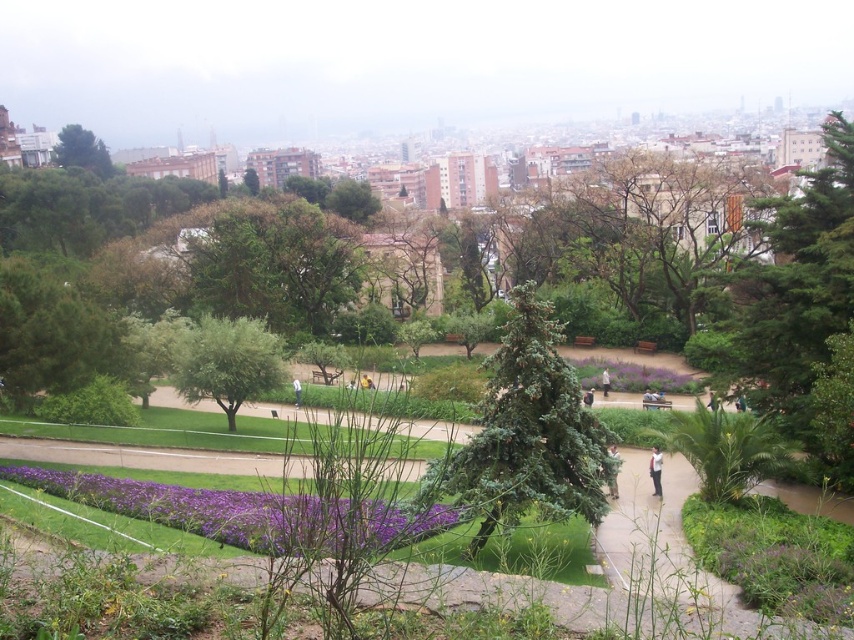
Between purple matte flower at center and brown leather backpack at center-right, which one appears on the right side from the viewer's perspective?

From the viewer's perspective, purple matte flower at center appears more on the right side.

Who is lower down, purple matte flower at center or brown leather backpack at center-right?

brown leather backpack at center-right

Locate an element on the screen. purple matte flower at center is located at coordinates (630, 376).

Find the location of a particular element. The image size is (854, 640). purple matte flower at center is located at coordinates (630, 376).

Which is below, purple matte flower at lower left or brown leather backpack at center-right?

purple matte flower at lower left

Can you confirm if purple matte flower at lower left is positioned to the left of brown leather backpack at center-right?

Indeed, purple matte flower at lower left is positioned on the left side of brown leather backpack at center-right.

At what (x,y) coordinates should I click in order to perform the action: click on purple matte flower at lower left. Please return your answer as a coordinate pair (x, y). This screenshot has height=640, width=854. Looking at the image, I should click on (246, 513).

Based on the photo, between green textured tree at center and white fabric person at center, which one is positioned lower?

green textured tree at center is lower down.

Which is behind, point (524, 452) or point (299, 394)?

The point (299, 394) is behind.

Who is more distant from viewer, [493,476] or [293,392]?

Point [293,392]

This screenshot has width=854, height=640. Identify the location of green textured tree at center. (525, 435).